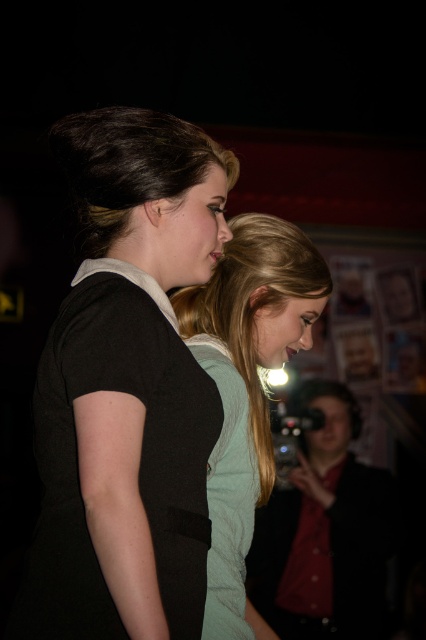
Is point (218, 486) positioned after point (351, 618)?

No.

Does light green fabric shirt at center appear under matte black camera at lower right?

No, light green fabric shirt at center is not below matte black camera at lower right.

I want to click on light green fabric shirt at center, so click(245, 385).

At what (x,y) coordinates should I click in order to perform the action: click on light green fabric shirt at center. Please return your answer as a coordinate pair (x, y). The width and height of the screenshot is (426, 640). Looking at the image, I should click on (245, 385).

Is shiny dark brown hair at upper center to the left of light teal fabric dress at center from the viewer's perspective?

Yes, shiny dark brown hair at upper center is to the left of light teal fabric dress at center.

Which is in front, point (91, 237) or point (207, 552)?

Point (207, 552) is in front.

This screenshot has width=426, height=640. Identify the location of shiny dark brown hair at upper center. (129, 164).

Who is more forward, (x=143, y=196) or (x=221, y=340)?

Point (x=143, y=196) is in front.

Does black matte dress at center appear on the right side of light green fabric shirt at center?

Incorrect, black matte dress at center is not on the right side of light green fabric shirt at center.

Which is in front, point (72, 609) or point (249, 228)?

Positioned in front is point (72, 609).

The width and height of the screenshot is (426, 640). What are the coordinates of `black matte dress at center` in the screenshot? It's located at (118, 472).